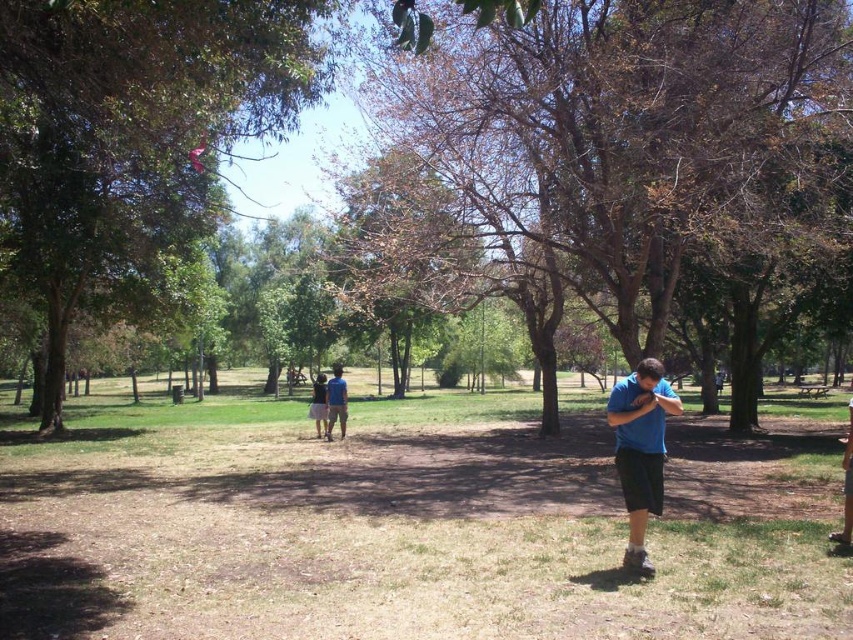
Who is positioned more to the left, brown leather bag at lower right or dark blue t-shirt at center?

dark blue t-shirt at center

Does point (844, 481) come in front of point (323, 429)?

Yes, it is.

Where is `brown leather bag at lower right`? brown leather bag at lower right is located at coordinates (846, 486).

Between green leafy tree at upper left and dark blue t-shirt at center, which one has less height?

dark blue t-shirt at center

Who is positioned more to the left, green leafy tree at upper left or dark blue t-shirt at center?

From the viewer's perspective, green leafy tree at upper left appears more on the left side.

Who is more forward, (15, 56) or (311, 396)?

Point (15, 56) is in front.

Locate an element on the screen. green leafy tree at upper left is located at coordinates point(132,132).

Is the position of brown grass at center less distant than that of blue cotton shirt at lower right?

Yes, it is in front of blue cotton shirt at lower right.

Which is behind, point (419, 637) or point (631, 413)?

Point (631, 413)

This screenshot has width=853, height=640. Identify the location of brown grass at center. (409, 522).